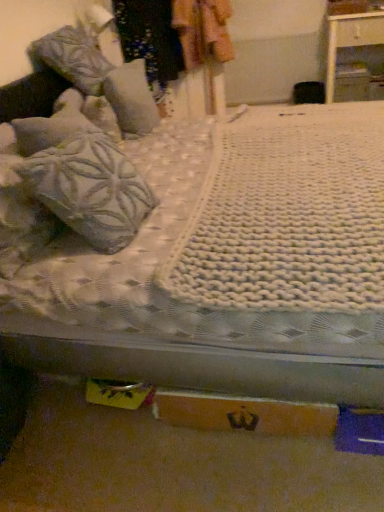
The height and width of the screenshot is (512, 384). What do you see at coordinates (288, 215) in the screenshot?
I see `white knitted blanket at center` at bounding box center [288, 215].

Where is `textured gray pillow at left, placed as the 1th pillow when sorted from front to back`? The image size is (384, 512). textured gray pillow at left, placed as the 1th pillow when sorted from front to back is located at coordinates (91, 189).

This screenshot has height=512, width=384. Describe the element at coordinates (91, 189) in the screenshot. I see `textured gray pillow at left, placed as the 1th pillow when sorted from front to back` at that location.

Where is `white knitted blanket at center`? The image size is (384, 512). white knitted blanket at center is located at coordinates (288, 215).

Between white knitted blanket at center and patterned fabric at upper center, which one appears on the right side from the viewer's perspective?

white knitted blanket at center is more to the right.

Between white knitted blanket at center and patterned fabric at upper center, which one has more height?

Standing taller between the two is patterned fabric at upper center.

Is orange cardboard box at lower center surrounding textured gray pillow at upper left, which is the 2th pillow from front to back?

No.

Is orange cardboard box at lower center touching textured gray pillow at upper left, which is the 2th pillow from front to back?

orange cardboard box at lower center and textured gray pillow at upper left, which is the 2th pillow from front to back, are not in contact.

From the image's perspective, does orange cardboard box at lower center appear lower than textured gray pillow at upper left, which is the first pillow from back to front?

Yes, from the image's perspective, orange cardboard box at lower center is below textured gray pillow at upper left, which is the first pillow from back to front.

Looking at this image, is white knitted blanket at center completely or partially outside of textured gray pillow at upper left, which is the 2th pillow from front to back?

Absolutely, white knitted blanket at center is external to textured gray pillow at upper left, which is the 2th pillow from front to back.

Are white knitted blanket at center and textured gray pillow at upper left, which is the first pillow from back to front, making contact?

No, white knitted blanket at center is not making contact with textured gray pillow at upper left, which is the first pillow from back to front.

From the picture: Between white knitted blanket at center and textured gray pillow at upper left, which is the first pillow from back to front, which one has more height?

With more height is textured gray pillow at upper left, which is the first pillow from back to front.

Does white knitted blanket at center have a smaller size compared to textured gray pillow at upper left, which is the first pillow from back to front?

Actually, white knitted blanket at center might be larger than textured gray pillow at upper left, which is the first pillow from back to front.

Is point (144, 90) less distant than point (73, 229)?

No, it is behind (73, 229).

Are textured gray pillow at upper left, which is the 2th pillow from front to back, and textured gray pillow at left, which is the 2th pillow from back to front, located far from each other?

textured gray pillow at upper left, which is the 2th pillow from front to back, is actually quite close to textured gray pillow at left, which is the 2th pillow from back to front.

Is textured gray pillow at upper left, which is the 2th pillow from front to back, positioned with its back to textured gray pillow at left, which is the 2th pillow from back to front?

That's not correct — textured gray pillow at upper left, which is the 2th pillow from front to back, is not looking away from textured gray pillow at left, which is the 2th pillow from back to front.

Is the position of textured gray pillow at upper left, which is the first pillow from back to front, more distant than that of textured gray pillow at left, which is the 2th pillow from back to front?

Yes.

Is textured gray pillow at upper left, which is the 2th pillow from front to back, outside of patterned fabric at upper center?

textured gray pillow at upper left, which is the 2th pillow from front to back, lies outside patterned fabric at upper center's area.

Where is `clothing on the right of textured gray pillow at upper left, which is the first pillow from back to front`? This screenshot has height=512, width=384. clothing on the right of textured gray pillow at upper left, which is the first pillow from back to front is located at coordinates (149, 38).

From a real-world perspective, is textured gray pillow at upper left, which is the 2th pillow from front to back, above or below patterned fabric at upper center?

textured gray pillow at upper left, which is the 2th pillow from front to back, is situated lower than patterned fabric at upper center in the real world.

You are a GUI agent. You are given a task and a screenshot of the screen. Output one action in this format:
    pyautogui.click(x=<x>, y=<y>)
    Task: Click on the cardboard box located on the left of white glossy nightstand at upper right
    
    Given the screenshot: What is the action you would take?
    pyautogui.click(x=244, y=414)

Who is smaller, white glossy nightstand at upper right or orange cardboard box at lower center?

With smaller size is orange cardboard box at lower center.

Is white glossy nightstand at upper right located outside orange cardboard box at lower center?

white glossy nightstand at upper right is positioned outside orange cardboard box at lower center.

Which is in front, point (334, 80) or point (196, 426)?

The point (196, 426) is in front.

Does point (41, 194) come in front of point (288, 421)?

Yes.

Is textured gray pillow at left, placed as the 1th pillow when sorted from front to back, aimed at orange cardboard box at lower center?

No, textured gray pillow at left, placed as the 1th pillow when sorted from front to back, is not aimed at orange cardboard box at lower center.

Could orange cardboard box at lower center be considered to be inside textured gray pillow at left, which is the 2th pillow from back to front?

Actually, orange cardboard box at lower center is outside textured gray pillow at left, which is the 2th pillow from back to front.

Where is `blanket below the patterned fabric at upper center (from a real-world perspective)`? The height and width of the screenshot is (512, 384). blanket below the patterned fabric at upper center (from a real-world perspective) is located at coordinates (288, 215).

Where is `the 2nd pillow above when counting from the orange cardboard box at lower center (from the image's perspective)`? The image size is (384, 512). the 2nd pillow above when counting from the orange cardboard box at lower center (from the image's perspective) is located at coordinates (131, 98).

Considering their positions, is white glossy nightstand at upper right positioned closer to textured gray pillow at left, which is the 2th pillow from back to front, than white knitted blanket at center?

white knitted blanket at center.

When comparing their distances from white knitted blanket at center, does textured gray pillow at upper left, which is the 2th pillow from front to back, or orange cardboard box at lower center seem further?

textured gray pillow at upper left, which is the 2th pillow from front to back, lies further to white knitted blanket at center than the other object.

Consider the image. From the image, which object appears to be nearer to textured gray pillow at left, placed as the 1th pillow when sorted from front to back, orange cardboard box at lower center or white knitted blanket at center?

white knitted blanket at center is closer to textured gray pillow at left, placed as the 1th pillow when sorted from front to back.

When comparing their distances from textured gray pillow at left, placed as the 1th pillow when sorted from front to back, does textured gray pillow at upper left, which is the 2th pillow from front to back, or patterned fabric at upper center seem further?

patterned fabric at upper center lies further to textured gray pillow at left, placed as the 1th pillow when sorted from front to back, than the other object.

From the image, which object appears to be farther from orange cardboard box at lower center, white glossy nightstand at upper right or textured gray pillow at upper left, which is the 2th pillow from front to back?

Among the two, white glossy nightstand at upper right is located further to orange cardboard box at lower center.

In the scene shown: When comparing their distances from textured gray pillow at upper left, which is the first pillow from back to front, does white glossy nightstand at upper right or orange cardboard box at lower center seem further?

Among the two, white glossy nightstand at upper right is located further to textured gray pillow at upper left, which is the first pillow from back to front.

From the image, which object appears to be farther from white glossy nightstand at upper right, white knitted blanket at center or textured gray pillow at left, which is the 2th pillow from back to front?

textured gray pillow at left, which is the 2th pillow from back to front, is further to white glossy nightstand at upper right.

Which object lies further to the anchor point white knitted blanket at center, orange cardboard box at lower center or patterned fabric at upper center?

patterned fabric at upper center is further to white knitted blanket at center.

Find the location of a particular element. This screenshot has width=384, height=512. blanket between textured gray pillow at left, which is the 2th pillow from back to front, and orange cardboard box at lower center from top to bottom is located at coordinates coord(288,215).

At what (x,y) coordinates should I click in order to perform the action: click on clothing positioned between textured gray pillow at left, placed as the 1th pillow when sorted from front to back, and white glossy nightstand at upper right from near to far. Please return your answer as a coordinate pair (x, y). Looking at the image, I should click on (149, 38).

Find the location of `pillow that lies between textured gray pillow at upper left, which is the 2th pillow from front to back, and orange cardboard box at lower center from top to bottom`. pillow that lies between textured gray pillow at upper left, which is the 2th pillow from front to back, and orange cardboard box at lower center from top to bottom is located at coordinates (91, 189).

This screenshot has width=384, height=512. I want to click on cardboard box positioned between white knitted blanket at center and white glossy nightstand at upper right from near to far, so click(244, 414).